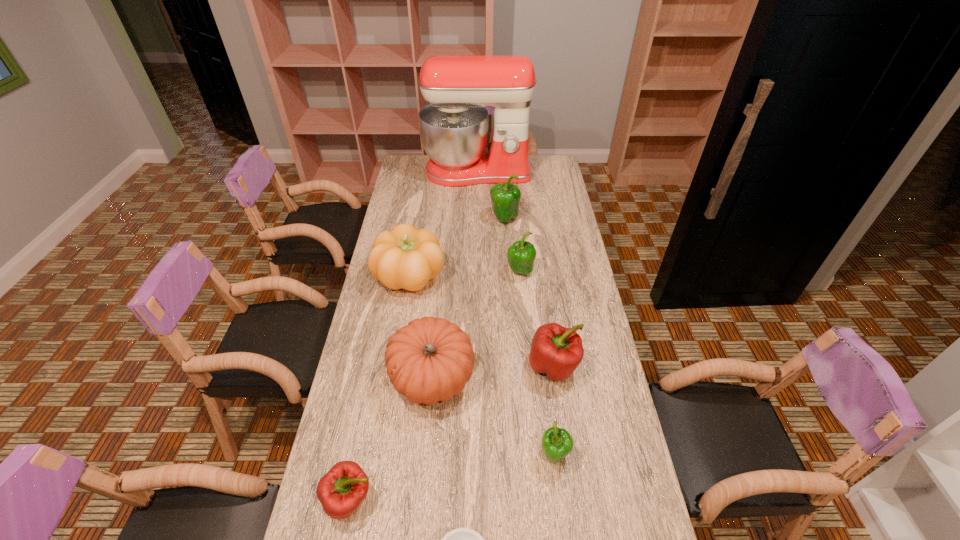
In order to click on green bell pepper that is the closest one to the smaller pink bell pepper in this screenshot , I will do `click(557, 443)`.

Where is `green bell pepper that is the closest one to the nearer pumpkin`? The height and width of the screenshot is (540, 960). green bell pepper that is the closest one to the nearer pumpkin is located at coordinates (557, 443).

What are the coordinates of `vacant position in the image that satisfies the following two spatial constraints: 1. on the front-facing side of the mixer; 2. on the left side of the second farthest bell pepper` in the screenshot? It's located at (477, 272).

Where is `free point that satisfies the following two spatial constraints: 1. on the front-facing side of the nearest green bell pepper; 2. on the right side of the tallest object`? The image size is (960, 540). free point that satisfies the following two spatial constraints: 1. on the front-facing side of the nearest green bell pepper; 2. on the right side of the tallest object is located at coordinates pyautogui.click(x=475, y=455).

Identify the location of free space that satisfies the following two spatial constraints: 1. on the front-facing side of the farthest object; 2. on the left side of the biggest green bell pepper. This screenshot has width=960, height=540. (477, 219).

I want to click on blank space that satisfies the following two spatial constraints: 1. on the back side of the taller pumpkin; 2. on the left side of the second nearest green bell pepper, so click(x=411, y=272).